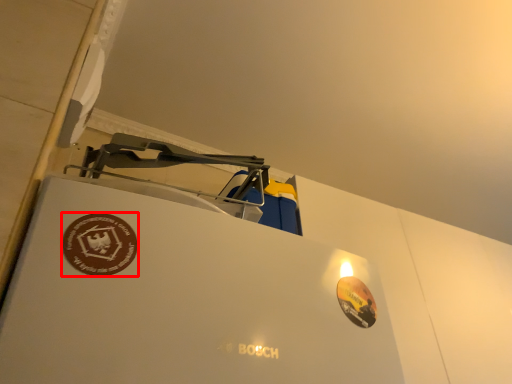
Question: From the image's perspective, what is the correct spatial positioning of logo (annotated by the red box) in reference to logo?

Choices:
 (A) above
 (B) below

Answer: (A)